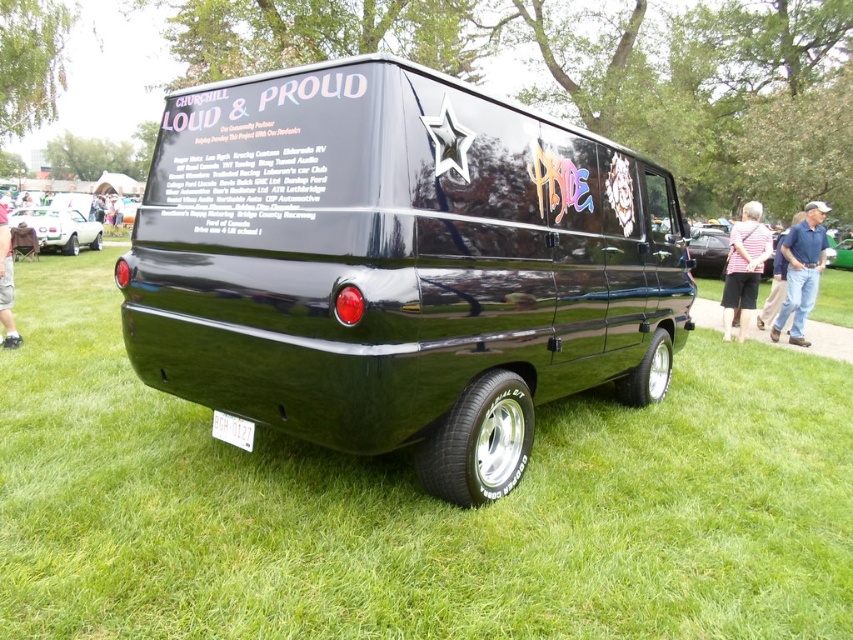
Question: Does matte white car at left have a lesser width compared to skinny jeans at lower left?

Choices:
 (A) no
 (B) yes

Answer: (A)

Question: Is blue jeans at right smaller than striped shirt at right?

Choices:
 (A) yes
 (B) no

Answer: (B)

Question: Which point is farther from the camera taking this photo?

Choices:
 (A) (7, 342)
 (B) (764, 228)
 (C) (712, 483)
 (D) (350, 273)

Answer: (B)

Question: From the image, what is the correct spatial relationship of green grass at lower center in relation to skinny jeans at lower left?

Choices:
 (A) right
 (B) left

Answer: (A)

Question: Estimate the real-world distances between objects in this image. Which object is farther from the blue jeans at right?

Choices:
 (A) striped shirt at right
 (B) matte white car at left
 (C) green grass at lower center
 (D) skinny jeans at lower left

Answer: (B)

Question: Which point is farther from the camera taking this photo?

Choices:
 (A) (792, 321)
 (B) (4, 214)
 (C) (753, 232)
 (D) (62, 228)

Answer: (D)